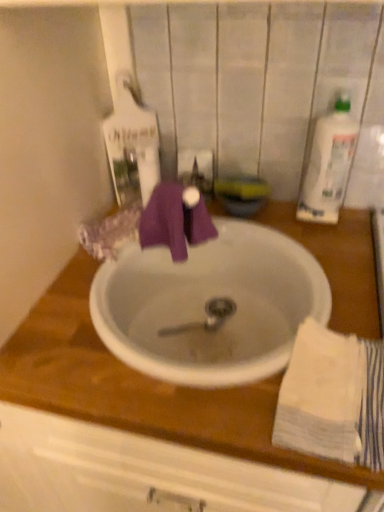
This screenshot has height=512, width=384. Find the location of `white plastic bottle at upper right`. white plastic bottle at upper right is located at coordinates (329, 164).

At what (x,y) coordinates should I click in order to perform the action: click on white ceramic sink at center. Please return your answer as a coordinate pair (x, y). The width and height of the screenshot is (384, 512). Looking at the image, I should click on pos(207,303).

From a real-world perspective, between white cotton towel at lower right and white plastic bottle at upper right, who is vertically higher?

white plastic bottle at upper right.

Which of these two, white cotton towel at lower right or white plastic bottle at upper right, is smaller?

white cotton towel at lower right is smaller.

Is point (311, 411) farther from camera compared to point (316, 161)?

No, it is not.

Which of these two, white plastic bottle at upper right or white cotton towel at lower right, is wider?

white cotton towel at lower right.

Is white plastic bottle at upper right facing away from white cotton towel at lower right?

white plastic bottle at upper right does not have its back to white cotton towel at lower right.

Are white plastic bottle at upper right and white cotton towel at lower right located far from each other?

No, white plastic bottle at upper right is not far from white cotton towel at lower right.

Between white plastic bottle at upper right and white cotton towel at lower right, which one appears on the left side from the viewer's perspective?

white cotton towel at lower right is more to the left.

Which is nearer, [339,187] or [242,330]?

Point [339,187] appears to be closer to the viewer than point [242,330].

Measure the distance between white plastic bottle at upper right and white ceramic sink at center.

10.95 inches.

Is white plastic bottle at upper right surrounding white ceramic sink at center?

No, white plastic bottle at upper right does not contain white ceramic sink at center.

Between white plastic bottle at upper right and white ceramic sink at center, which one has larger width?

white ceramic sink at center is wider.

Which is behind, white ceramic sink at center or white plastic bottle at upper right?

Positioned behind is white plastic bottle at upper right.

From the picture: From the image's perspective, relative to white plastic bottle at upper right, is white ceramic sink at center above or below?

Clearly, from the image's perspective, white ceramic sink at center is below white plastic bottle at upper right.

Visually, is white ceramic sink at center positioned to the left or to the right of white plastic bottle at upper right?

From the image, it's evident that white ceramic sink at center is to the left of white plastic bottle at upper right.

Is white ceramic sink at center touching white plastic bottle at upper right?

white ceramic sink at center is not next to white plastic bottle at upper right, and they're not touching.

From the image's perspective, which is above, white cotton towel at lower right or white ceramic sink at center?

white ceramic sink at center is shown above in the image.

Can you confirm if white cotton towel at lower right is taller than white ceramic sink at center?

Incorrect, the height of white cotton towel at lower right is not larger of that of white ceramic sink at center.

How far apart are white cotton towel at lower right and white ceramic sink at center?

The distance of white cotton towel at lower right from white ceramic sink at center is 24.13 centimeters.

Who is bigger, white cotton towel at lower right or white ceramic sink at center?

white ceramic sink at center.

Is white ceramic sink at center not inside white cotton towel at lower right?

white ceramic sink at center lies outside white cotton towel at lower right's area.

Looking at the image, does white ceramic sink at center seem bigger or smaller compared to white cotton towel at lower right?

Clearly, white ceramic sink at center is larger in size than white cotton towel at lower right.

Between white ceramic sink at center and white cotton towel at lower right, which one has larger width?

With larger width is white ceramic sink at center.

Where is `bath towel in front of the white plastic bottle at upper right`? bath towel in front of the white plastic bottle at upper right is located at coordinates point(333,398).

What are the coordinates of `bath towel lying on the left of white plastic bottle at upper right` in the screenshot? It's located at (333, 398).

Looking at the image, which one is located closer to white cotton towel at lower right, white ceramic sink at center or white plastic bottle at upper right?

The object closer to white cotton towel at lower right is white ceramic sink at center.

When comparing their distances from white ceramic sink at center, does white plastic bottle at upper right or white cotton towel at lower right seem further?

The object further to white ceramic sink at center is white plastic bottle at upper right.

Based on their spatial positions, is white cotton towel at lower right or white ceramic sink at center closer to white plastic bottle at upper right?

Among the two, white ceramic sink at center is located nearer to white plastic bottle at upper right.

Based on their spatial positions, is white cotton towel at lower right or white plastic bottle at upper right closer to white ceramic sink at center?

Among the two, white cotton towel at lower right is located nearer to white ceramic sink at center.

When comparing their distances from white cotton towel at lower right, does white plastic bottle at upper right or white ceramic sink at center seem further?

white plastic bottle at upper right is further to white cotton towel at lower right.

When comparing their distances from white plastic bottle at upper right, does white ceramic sink at center or white cotton towel at lower right seem further?

Among the two, white cotton towel at lower right is located further to white plastic bottle at upper right.

At what (x,y) coordinates should I click in order to perform the action: click on sink between white plastic bottle at upper right and white cotton towel at lower right in the vertical direction. Please return your answer as a coordinate pair (x, y). Image resolution: width=384 pixels, height=512 pixels. Looking at the image, I should click on point(207,303).